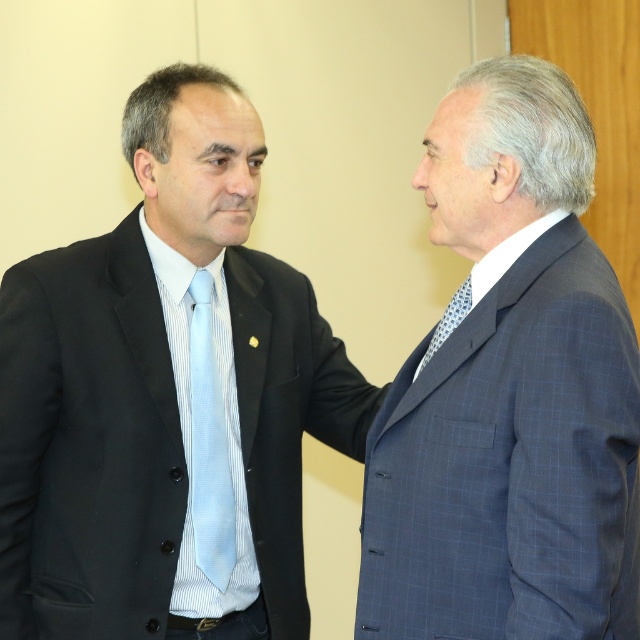
You are a photographer setting up for a professional photo shoot. The two subjects are wearing the matte black suit at left and the blue checkered suit at right. You need to position them so that their suits are clearly visible in the frame. Given that the camera has a minimum focus distance of 18 inches, will you be able to capture both suits in focus without moving the camera or subjects?

The matte black suit at left and blue checkered suit at right are 18.86 inches apart. Since the minimum focus distance is 18 inches, the 18.86 inch separation means the camera can focus on both suits as they are within the required distance.

Looking at this image, you are an assistant analyzing the positions of objects in the image. The scene shows two men in a professional setting. The man on the left wears a black suit jacket with a light blue silk tie at left. The man on the right wears a dark blue suit jacket. Can you determine which object from the given labels is positioned closer to the bottom edge of the image?

The light blue silk tie at left is located at point (209, 444), which means it is closer to the bottom edge of the image compared to other elements in the scene.